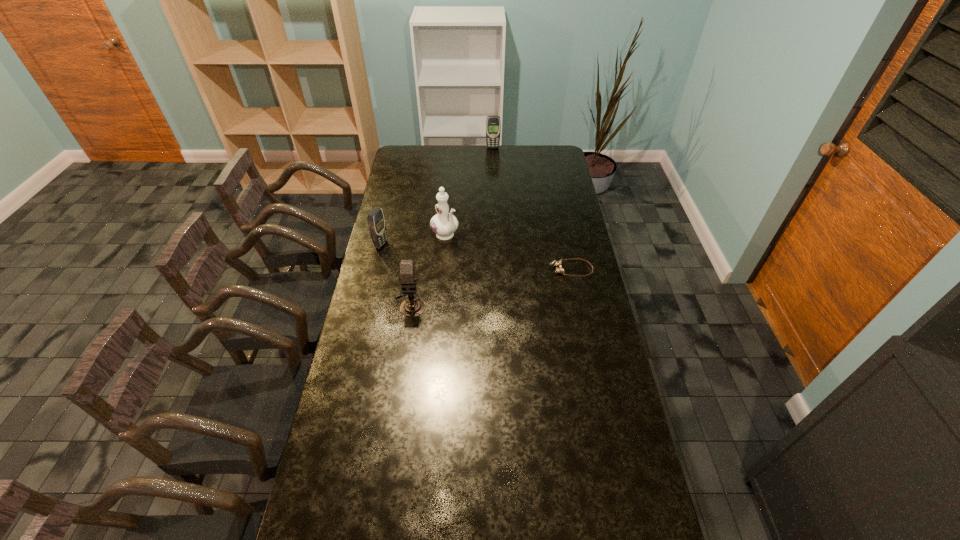
Locate an element on the screen. vacant space situated on the front face of the leftmost object is located at coordinates [x=451, y=266].

The image size is (960, 540). I want to click on object that is positioned at the far edge, so click(x=493, y=125).

The height and width of the screenshot is (540, 960). Find the location of `microphone present at the left edge`. microphone present at the left edge is located at coordinates (411, 307).

I want to click on cellular telephone located in the left edge section of the desktop, so click(376, 222).

Image resolution: width=960 pixels, height=540 pixels. Find the location of `object that is at the right edge`. object that is at the right edge is located at coordinates (557, 264).

This screenshot has width=960, height=540. Identify the location of vacant space at the far edge of the desktop. (430, 151).

This screenshot has height=540, width=960. Find the location of `vacant region at the near edge`. vacant region at the near edge is located at coordinates (544, 515).

At what (x,y) coordinates should I click in order to perform the action: click on free space at the left edge of the desktop. Please return your answer as a coordinate pair (x, y). The height and width of the screenshot is (540, 960). Looking at the image, I should click on (351, 366).

Where is `vacant space at the right edge of the desktop`? This screenshot has height=540, width=960. vacant space at the right edge of the desktop is located at coordinates (568, 213).

At what (x,y) coordinates should I click in order to perform the action: click on free region at the far left corner. Please return your answer as a coordinate pair (x, y). Image resolution: width=960 pixels, height=540 pixels. Looking at the image, I should click on (402, 148).